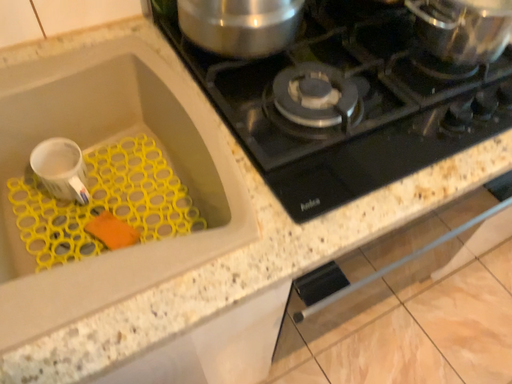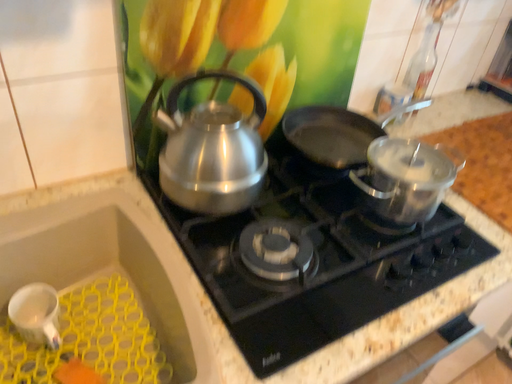
Question: How did the camera likely rotate when shooting the video?

Choices:
 (A) rotated upward
 (B) rotated downward

Answer: (A)